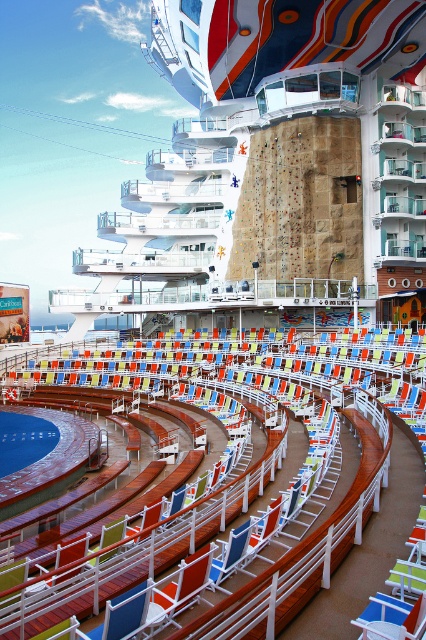
Which is below, white glossy cruise ship at center or blue plastic beach chair at center?

blue plastic beach chair at center

Between white glossy cruise ship at center and blue plastic beach chair at center, which one appears on the left side from the viewer's perspective?

white glossy cruise ship at center is more to the left.

Is point (385, 122) farther from viewer compared to point (376, 625)?

Yes, point (385, 122) is behind point (376, 625).

I want to click on white glossy cruise ship at center, so click(x=273, y=161).